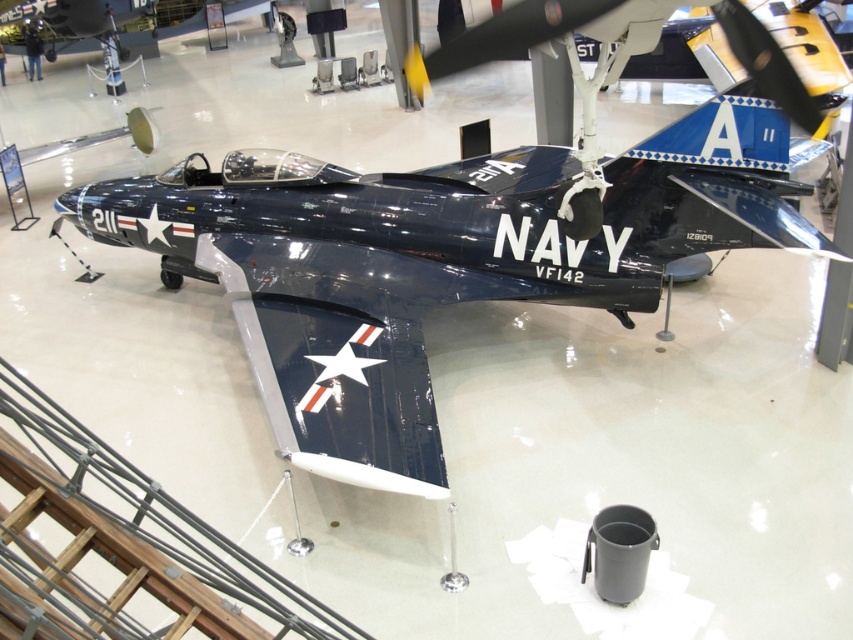
Which is above, glossy navy blue airplane at center or glossy metallic airplane at center?

glossy metallic airplane at center

Which is behind, point (277, 193) or point (79, 42)?

Point (79, 42)

Does point (428, 486) come closer to viewer compared to point (204, 24)?

Yes, point (428, 486) is closer to viewer.

You are a GUI agent. You are given a task and a screenshot of the screen. Output one action in this format:
    pyautogui.click(x=<x>, y=<y>)
    Task: Click on the glossy navy blue airplane at center
    The width and height of the screenshot is (853, 640).
    Given the screenshot: What is the action you would take?
    pyautogui.click(x=433, y=260)